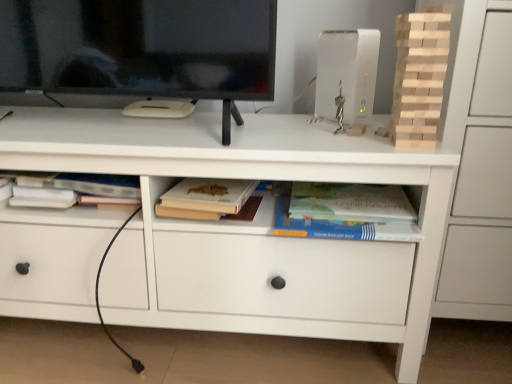
What is the approximate height of natural wood tower at upper right?

10.91 inches.

What is the approximate width of matte beige book at center, which ranks as the first paperback book in left-to-right order?

10.60 inches.

Find the location of a particular element. white matte chest of drawers at center is located at coordinates (248, 227).

Find the location of a particular element. white plastic router at upper right is located at coordinates (347, 78).

Where is `hardcover book at center, acting as the second paperback book starting from the left`? The image size is (512, 384). hardcover book at center, acting as the second paperback book starting from the left is located at coordinates (346, 212).

Is the surface of white matte chest of drawers at center in direct contact with matte beige book at center, which ranks as the first paperback book in left-to-right order?

No, white matte chest of drawers at center is not in contact with matte beige book at center, which ranks as the first paperback book in left-to-right order.

How many degrees apart are the facing directions of white matte chest of drawers at center and matte beige book at center, marked as the 2th paperback book in a right-to-left arrangement?

They differ by 0.127 degrees in their facing directions.

Based on the photo, from a real-world perspective, between white matte chest of drawers at center and matte beige book at center, which ranks as the first paperback book in left-to-right order, who is vertically lower?

From a 3D spatial view, white matte chest of drawers at center is below.

Considering the relative sizes of white matte chest of drawers at center and matte beige book at center, which ranks as the first paperback book in left-to-right order, in the image provided, is white matte chest of drawers at center smaller than matte beige book at center, which ranks as the first paperback book in left-to-right order,?

No.

From the picture: Considering the relative positions of hardcover book at center, arranged as the 1th paperback book when viewed from the right, and white matte chest of drawers at center in the image provided, is hardcover book at center, arranged as the 1th paperback book when viewed from the right, to the right of white matte chest of drawers at center from the viewer's perspective?

Correct, you'll find hardcover book at center, arranged as the 1th paperback book when viewed from the right, to the right of white matte chest of drawers at center.

Does hardcover book at center, arranged as the 1th paperback book when viewed from the right, have a greater height compared to white matte chest of drawers at center?

Incorrect, the height of hardcover book at center, arranged as the 1th paperback book when viewed from the right, is not larger of that of white matte chest of drawers at center.

Would you say hardcover book at center, arranged as the 1th paperback book when viewed from the right, is outside white matte chest of drawers at center?

Actually, hardcover book at center, arranged as the 1th paperback book when viewed from the right, is within white matte chest of drawers at center.

Is hardcover book at center, acting as the second paperback book starting from the left, not near white matte chest of drawers at center?

They are positioned close to each other.

Is natural wood tower at upper right oriented away from white matte chest of drawers at center?

No, natural wood tower at upper right is not facing the opposite direction of white matte chest of drawers at center.

Between natural wood tower at upper right and white matte chest of drawers at center, which one has larger size?

white matte chest of drawers at center.

Between natural wood tower at upper right and white matte chest of drawers at center, which one has smaller width?

natural wood tower at upper right.

Is natural wood tower at upper right next to white plastic router at upper right and touching it?

They are not placed beside each other.

Considering the relative positions of natural wood tower at upper right and white plastic router at upper right in the image provided, is natural wood tower at upper right to the left of white plastic router at upper right from the viewer's perspective?

Incorrect, natural wood tower at upper right is not on the left side of white plastic router at upper right.

Is point (436, 23) farther from viewer compared to point (335, 72)?

That is False.

From a real-world perspective, is matte beige book at center, marked as the 2th paperback book in a right-to-left arrangement, physically located above or below hardcover book at center, acting as the second paperback book starting from the left?

From a real-world perspective, matte beige book at center, marked as the 2th paperback book in a right-to-left arrangement, is physically above hardcover book at center, acting as the second paperback book starting from the left.

Based on the photo, from the image's perspective, is matte beige book at center, marked as the 2th paperback book in a right-to-left arrangement, located above or below hardcover book at center, arranged as the 1th paperback book when viewed from the right?

Based on their image positions, matte beige book at center, marked as the 2th paperback book in a right-to-left arrangement, is located above hardcover book at center, arranged as the 1th paperback book when viewed from the right.

How many degrees apart are the facing directions of matte beige book at center, marked as the 2th paperback book in a right-to-left arrangement, and hardcover book at center, arranged as the 1th paperback book when viewed from the right?

The facing directions of matte beige book at center, marked as the 2th paperback book in a right-to-left arrangement, and hardcover book at center, arranged as the 1th paperback book when viewed from the right, are 2.55e-05 degrees apart.

In terms of size, does matte beige book at center, marked as the 2th paperback book in a right-to-left arrangement, appear bigger or smaller than hardcover book at center, arranged as the 1th paperback book when viewed from the right?

Clearly, matte beige book at center, marked as the 2th paperback book in a right-to-left arrangement, is smaller in size than hardcover book at center, arranged as the 1th paperback book when viewed from the right.

Does white plastic router at upper right have a greater width compared to white matte chest of drawers at center?

No, white plastic router at upper right is not wider than white matte chest of drawers at center.

Is white matte chest of drawers at center inside white plastic router at upper right?

No, white plastic router at upper right does not contain white matte chest of drawers at center.

Where is `chest of drawers below the white plastic router at upper right (from a real-world perspective)`? This screenshot has height=384, width=512. chest of drawers below the white plastic router at upper right (from a real-world perspective) is located at coordinates (248, 227).

Is white plastic router at upper right bigger or smaller than white matte chest of drawers at center?

Clearly, white plastic router at upper right is smaller in size than white matte chest of drawers at center.

Who is shorter, matte beige book at center, marked as the 2th paperback book in a right-to-left arrangement, or natural wood tower at upper right?

matte beige book at center, marked as the 2th paperback book in a right-to-left arrangement.

Who is bigger, matte beige book at center, marked as the 2th paperback book in a right-to-left arrangement, or natural wood tower at upper right?

Bigger between the two is matte beige book at center, marked as the 2th paperback book in a right-to-left arrangement.

Does matte beige book at center, which ranks as the first paperback book in left-to-right order, come in front of natural wood tower at upper right?

No, it is behind natural wood tower at upper right.

From a real-world perspective, count 2nd paperback books upward from the white matte chest of drawers at center and point to it. Please provide its 2D coordinates.

[(205, 198)]

Where is `chest of drawers in front of the hardcover book at center, acting as the second paperback book starting from the left`? This screenshot has height=384, width=512. chest of drawers in front of the hardcover book at center, acting as the second paperback book starting from the left is located at coordinates (248, 227).

Consider the image. Based on their spatial positions, is hardcover book at center, arranged as the 1th paperback book when viewed from the right, or matte beige book at center, marked as the 2th paperback book in a right-to-left arrangement, further from white matte chest of drawers at center?

Based on the image, hardcover book at center, arranged as the 1th paperback book when viewed from the right, appears to be further to white matte chest of drawers at center.

Based on their spatial positions, is natural wood tower at upper right or white plastic router at upper right closer to matte beige book at center, which ranks as the first paperback book in left-to-right order?

The object closer to matte beige book at center, which ranks as the first paperback book in left-to-right order, is white plastic router at upper right.

Considering their positions, is hardcover book at center, acting as the second paperback book starting from the left, positioned further to white matte chest of drawers at center than white plastic router at upper right?

white plastic router at upper right is further to white matte chest of drawers at center.

When comparing their distances from natural wood tower at upper right, does white plastic router at upper right or white matte chest of drawers at center seem closer?

white plastic router at upper right is positioned closer to the anchor natural wood tower at upper right.

From the image, which object appears to be farther from white matte chest of drawers at center, hardcover book at center, arranged as the 1th paperback book when viewed from the right, or natural wood tower at upper right?

Based on the image, natural wood tower at upper right appears to be further to white matte chest of drawers at center.

When comparing their distances from natural wood tower at upper right, does white plastic router at upper right or matte beige book at center, which ranks as the first paperback book in left-to-right order, seem further?

matte beige book at center, which ranks as the first paperback book in left-to-right order, is positioned further to the anchor natural wood tower at upper right.

From the picture: Based on their spatial positions, is hardcover book at center, arranged as the 1th paperback book when viewed from the right, or white plastic router at upper right closer to natural wood tower at upper right?

white plastic router at upper right lies closer to natural wood tower at upper right than the other object.

Based on their spatial positions, is hardcover book at center, acting as the second paperback book starting from the left, or white matte chest of drawers at center further from natural wood tower at upper right?

white matte chest of drawers at center is positioned further to the anchor natural wood tower at upper right.

Find the location of a particular element. paperback book situated between white matte chest of drawers at center and hardcover book at center, arranged as the 1th paperback book when viewed from the right, from left to right is located at coordinates (205, 198).

This screenshot has width=512, height=384. I want to click on book that lies between white plastic router at upper right and hardcover book at center, arranged as the 1th paperback book when viewed from the right, from top to bottom, so click(x=419, y=78).

The height and width of the screenshot is (384, 512). I want to click on equipment located between white matte chest of drawers at center and natural wood tower at upper right in the left-right direction, so click(347, 78).

The image size is (512, 384). I want to click on paperback book located between matte beige book at center, which ranks as the first paperback book in left-to-right order, and white plastic router at upper right in the left-right direction, so click(346, 212).